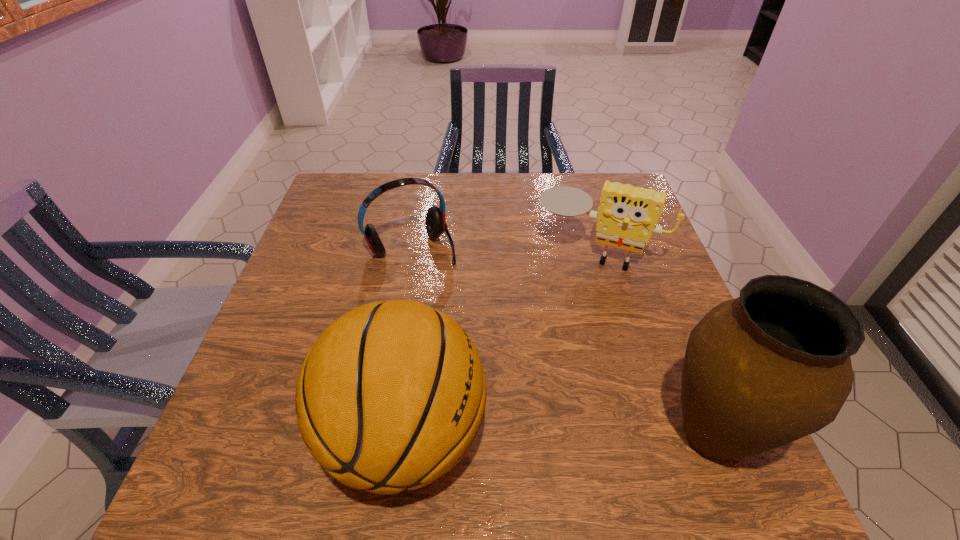
Where is `vacant space on the desktop that is between the basketball and the urn and is positioned on the front-facing side of the sponge`? vacant space on the desktop that is between the basketball and the urn and is positioned on the front-facing side of the sponge is located at coordinates (531, 435).

At what (x,y) coordinates should I click in order to perform the action: click on vacant spot on the desktop that is between the basketball and the urn and is positioned with the microphone attached to the side of the headset. Please return your answer as a coordinate pair (x, y). The image size is (960, 540). Looking at the image, I should click on click(x=524, y=435).